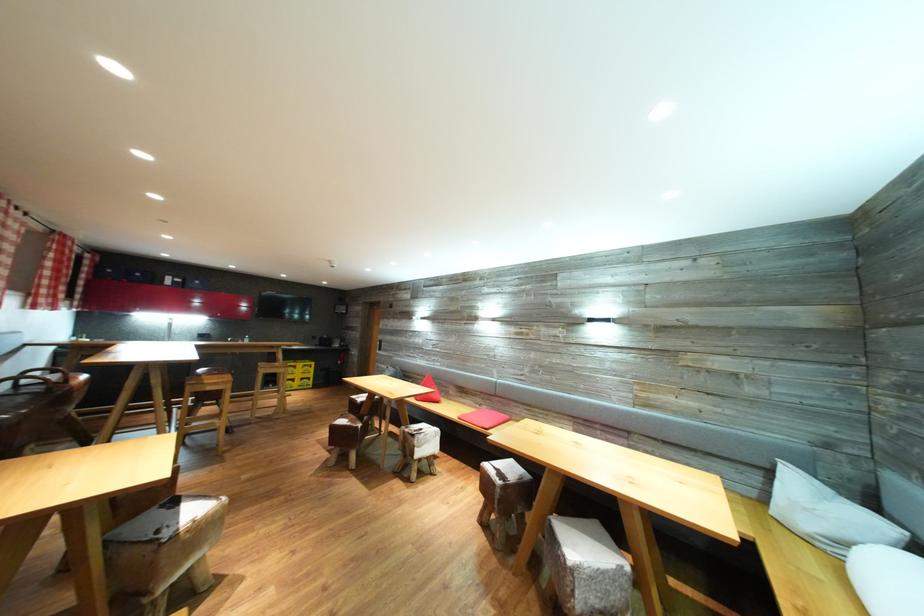
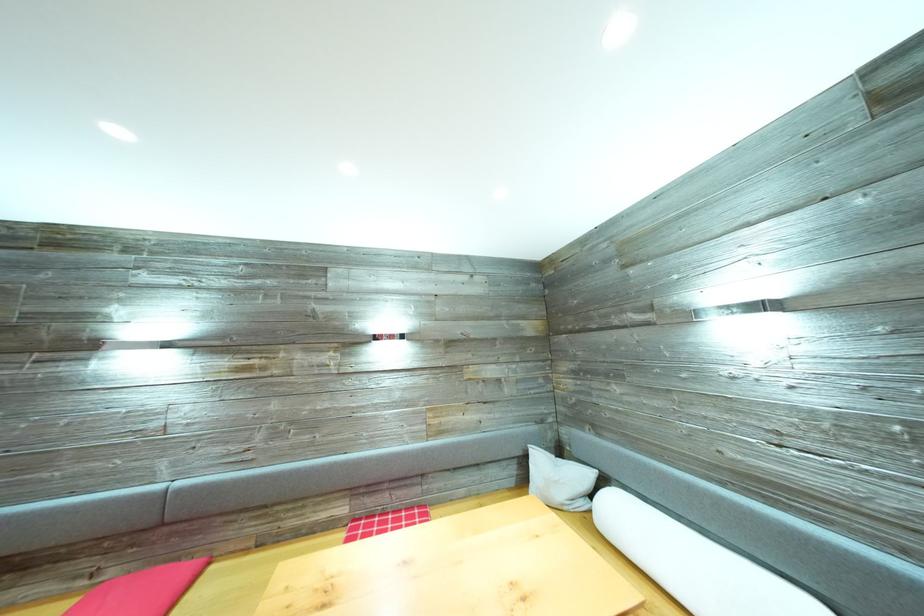
Where in the second image is the point corresponding to (812,515) from the first image?

(563, 488)